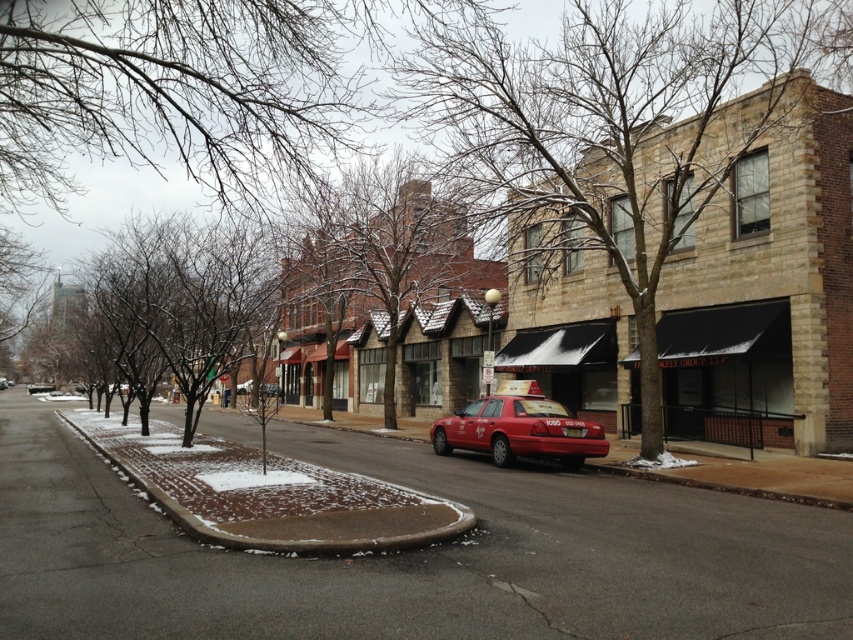
Does metallic silver taxi at center have a larger size compared to red matte taxi at center?

Correct, metallic silver taxi at center is larger in size than red matte taxi at center.

Can you confirm if metallic silver taxi at center is wider than red matte taxi at center?

Yes, metallic silver taxi at center is wider than red matte taxi at center.

You are a GUI agent. You are given a task and a screenshot of the screen. Output one action in this format:
    pyautogui.click(x=<x>, y=<y>)
    Task: Click on the metallic silver taxi at center
    The height and width of the screenshot is (640, 853).
    Given the screenshot: What is the action you would take?
    pyautogui.click(x=39, y=387)

Is shiny red taxi at center bigger than metallic silver taxi at center?

Indeed, shiny red taxi at center has a larger size compared to metallic silver taxi at center.

Does shiny red taxi at center appear over metallic silver taxi at center?

Yes.

Does point (575, 461) come closer to viewer compared to point (49, 387)?

Yes.

Identify the location of shiny red taxi at center. The width and height of the screenshot is (853, 640). (519, 428).

Who is positioned more to the left, shiny red taxi at center or red matte taxi at center?

red matte taxi at center is more to the left.

Between shiny red taxi at center and red matte taxi at center, which one has less height?

red matte taxi at center

Locate an element on the screen. The width and height of the screenshot is (853, 640). shiny red taxi at center is located at coordinates (519, 428).